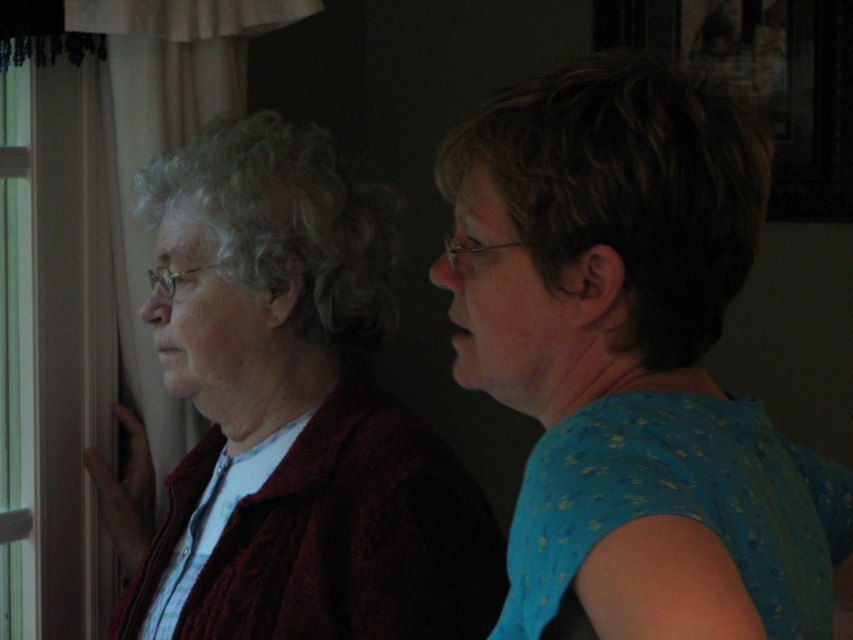
Question: Among these objects, which one is nearest to the camera?

Choices:
 (A) transparent glass window at left
 (B) knitted maroon sweater at left
 (C) blue dotted blouse at right

Answer: (C)

Question: Which object is closer to the camera taking this photo?

Choices:
 (A) blue dotted blouse at right
 (B) knitted maroon sweater at left

Answer: (A)

Question: Does blue dotted blouse at right have a larger size compared to knitted maroon sweater at left?

Choices:
 (A) no
 (B) yes

Answer: (A)

Question: Which of the following is the farthest from the observer?

Choices:
 (A) transparent glass window at left
 (B) blue dotted blouse at right
 (C) knitted maroon sweater at left

Answer: (A)

Question: Can you confirm if blue dotted blouse at right is positioned above transparent glass window at left?

Choices:
 (A) yes
 (B) no

Answer: (A)

Question: Is blue dotted blouse at right further to the viewer compared to transparent glass window at left?

Choices:
 (A) no
 (B) yes

Answer: (A)